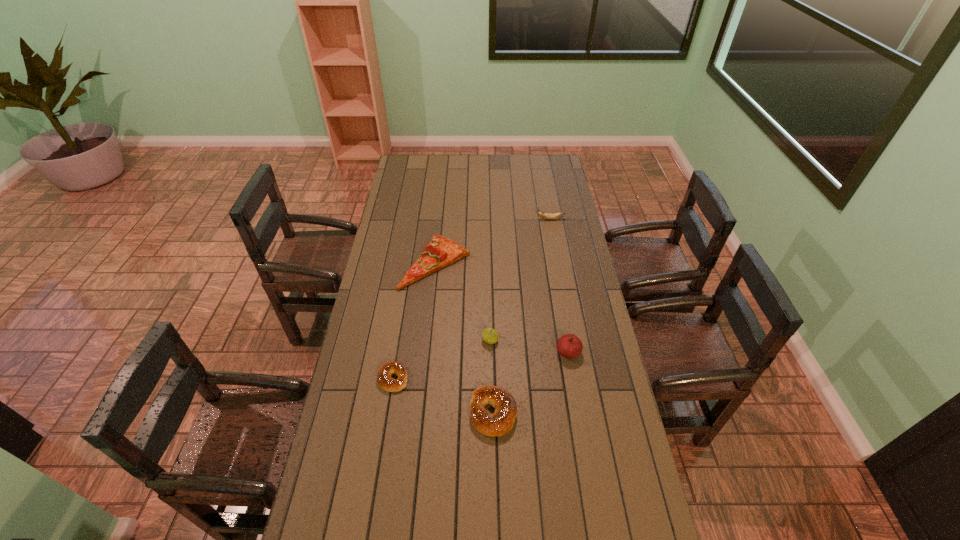
Observe the arrangement of all bagels in the image. To keep them evenly spaced, where would you place another bagel on the right? Please locate a free space. Please provide its 2D coordinates. Your answer should be formatted as a tuple, i.e. [(x, y)], where the tuple contains the x and y coordinates of a point satisfying the conditions above.

[(608, 452)]